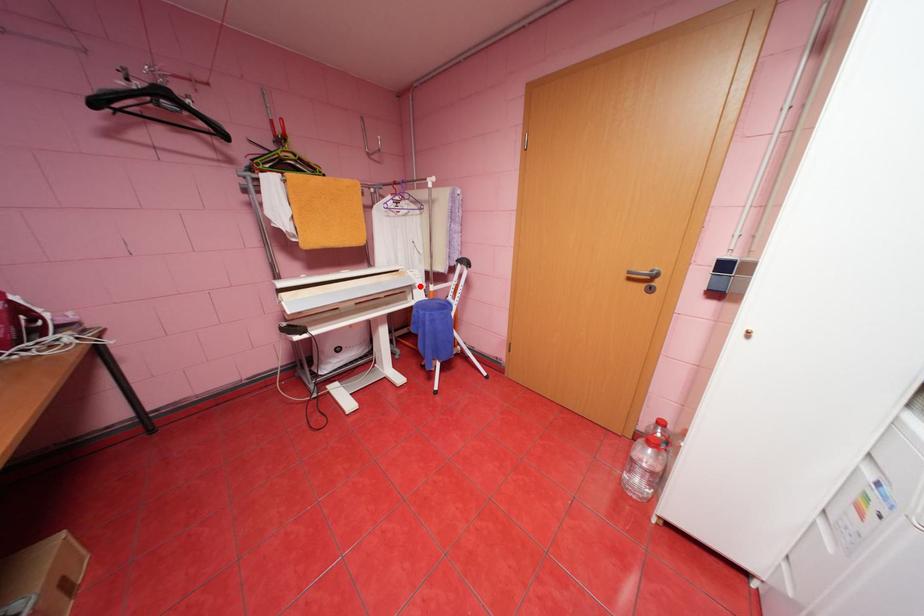
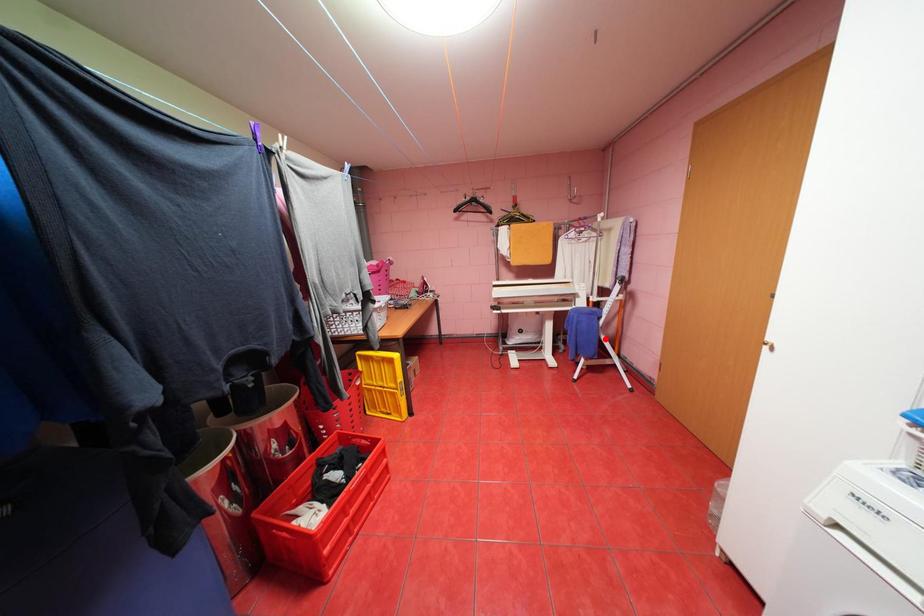
I am providing you with two images of the same scene from different viewpoints. A red point is marked on the first image and another point is marked on the second image. Are the points marked in image1 and image2 representing the same 3D position?

No